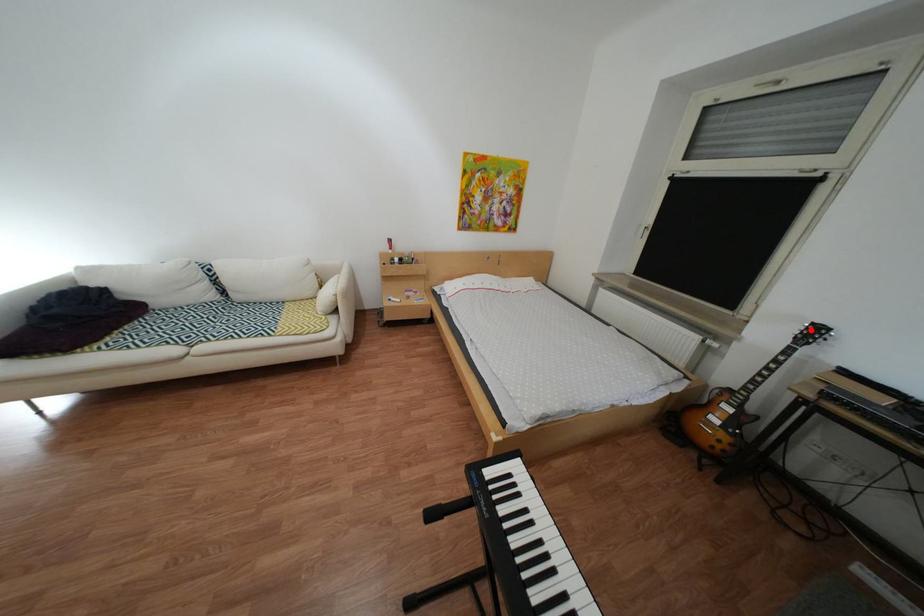
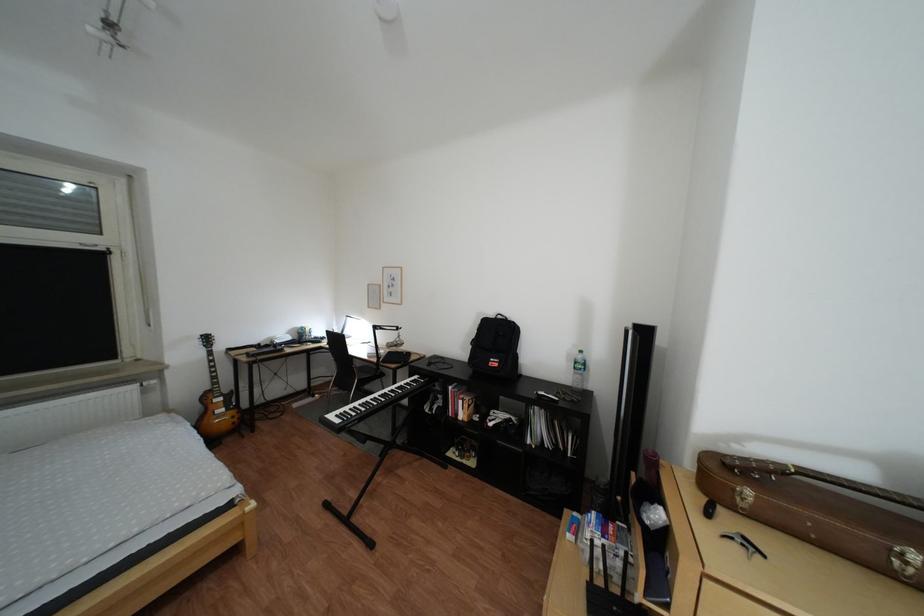
The point at the highlighted location is marked in the first image. Where is the corresponding point in the second image?

(213, 344)